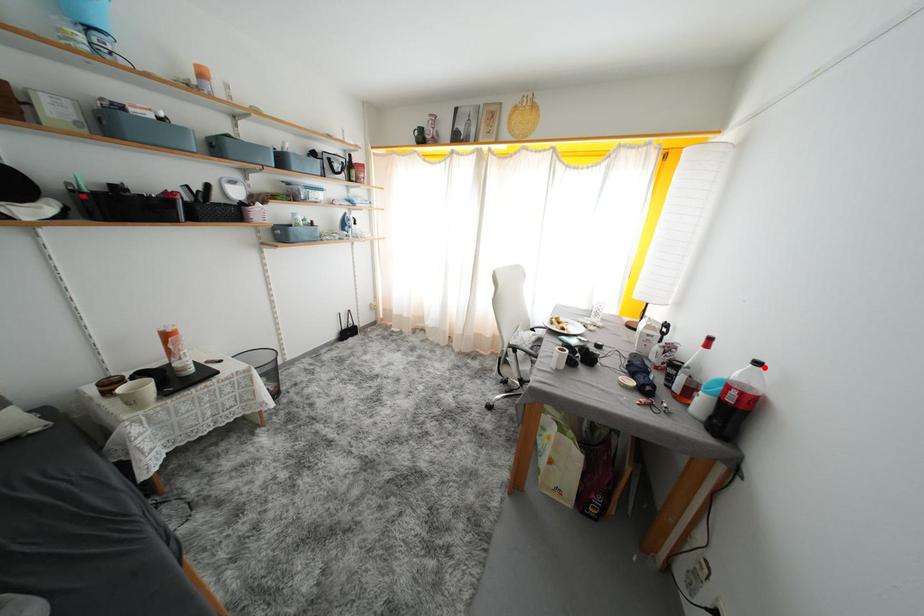
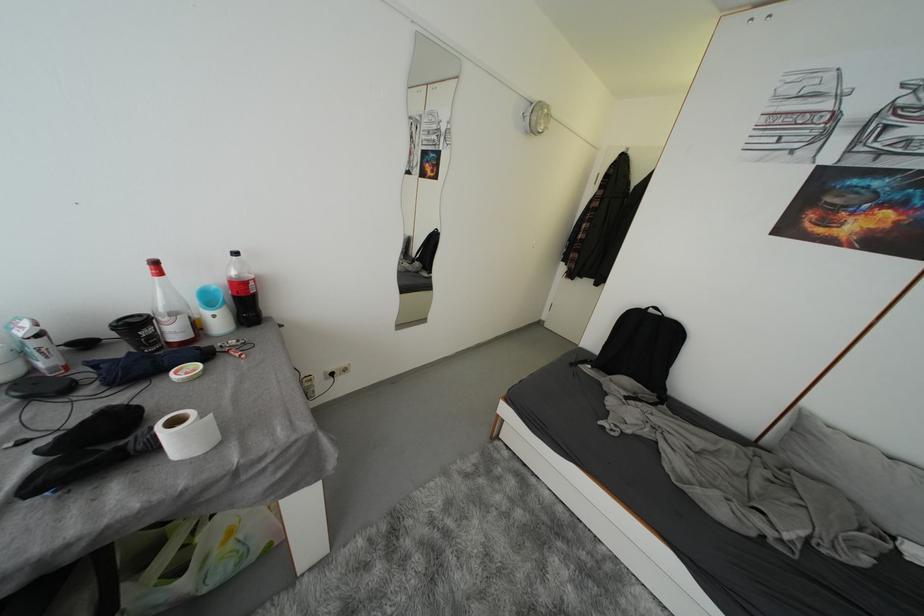
Find the pixel in the second image that matches the highlighted location in the first image.

(242, 257)